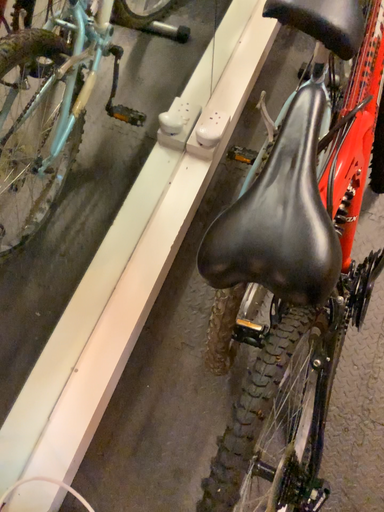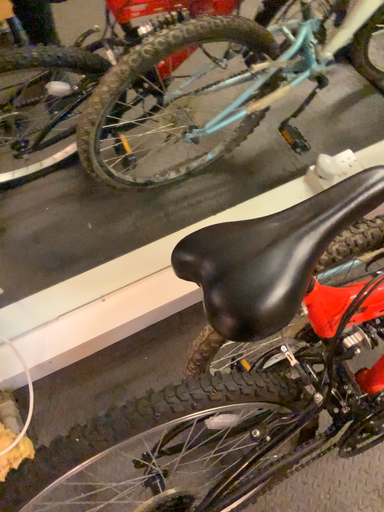
Question: How did the camera likely rotate when shooting the video?

Choices:
 (A) rotated downward
 (B) rotated upward

Answer: (B)